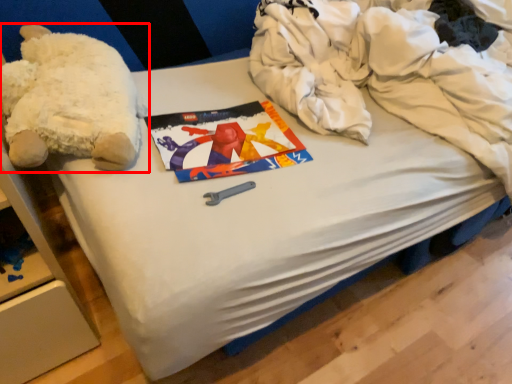
Question: In this image, where is teddy bear (annotated by the red box) located relative to clothing?

Choices:
 (A) right
 (B) left

Answer: (B)